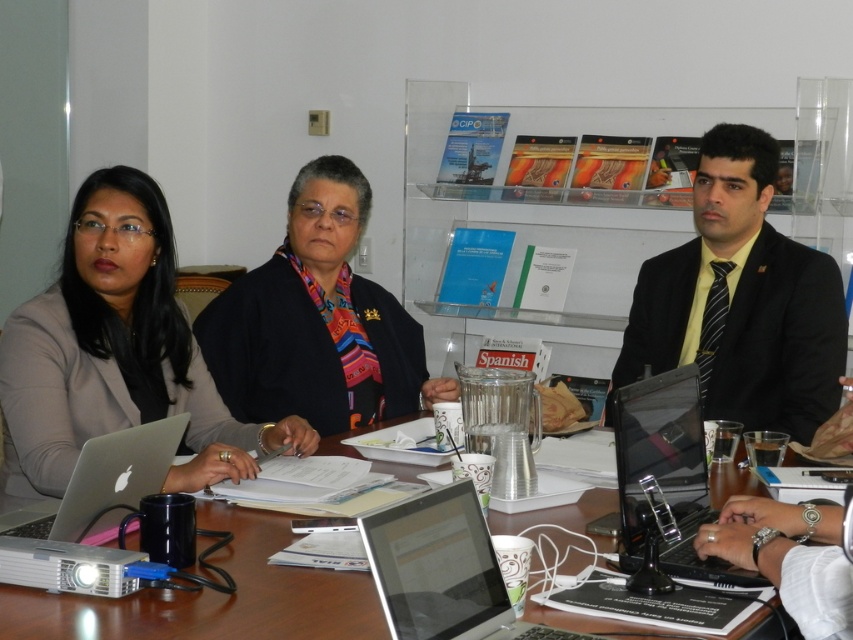
Does matte black sweater at center have a lesser height compared to white paper at center?

In fact, matte black sweater at center may be taller than white paper at center.

Between matte black sweater at center and white paper at center, which one is positioned lower?

white paper at center is lower down.

The height and width of the screenshot is (640, 853). I want to click on matte black sweater at center, so click(317, 321).

The height and width of the screenshot is (640, 853). What are the coordinates of `matte black sweater at center` in the screenshot? It's located at tap(317, 321).

Describe the element at coordinates (213, 596) in the screenshot. I see `white paper at center` at that location.

Which is behind, point (370, 618) or point (401, 618)?

Positioned behind is point (370, 618).

The width and height of the screenshot is (853, 640). I want to click on white paper at center, so click(213, 596).

Measure the distance from matte black sweater at center to silver metallic laptop at center.

matte black sweater at center and silver metallic laptop at center are 1.32 meters apart.

In the scene shown: Who is more forward, (238, 317) or (408, 502)?

Positioned in front is point (408, 502).

Is point (244, 330) closer to viewer compared to point (384, 608)?

No.

The height and width of the screenshot is (640, 853). I want to click on matte black sweater at center, so click(317, 321).